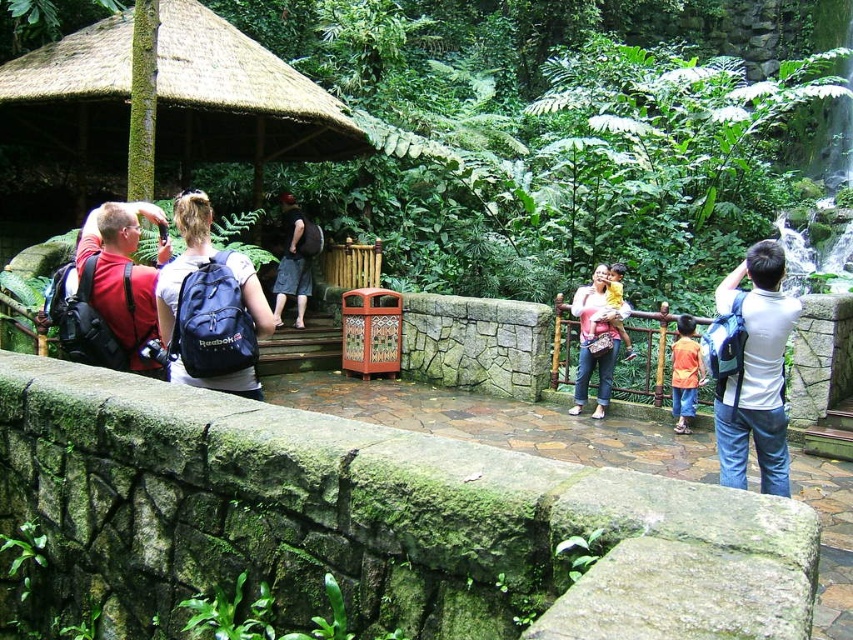
Does pink fabric purse at center have a smaller size compared to orange fabric shirt at center?

No.

Can you confirm if pink fabric purse at center is positioned below orange fabric shirt at center?

Incorrect, pink fabric purse at center is not positioned below orange fabric shirt at center.

The image size is (853, 640). In order to click on pink fabric purse at center in this screenshot , I will do `click(599, 333)`.

Who is positioned more to the right, white fabric backpack at right or matte red backpack at left?

From the viewer's perspective, white fabric backpack at right appears more on the right side.

Which is above, white fabric backpack at right or matte red backpack at left?

matte red backpack at left is above.

Which is behind, point (756, 396) or point (120, 298)?

The point (756, 396) is behind.

You are a GUI agent. You are given a task and a screenshot of the screen. Output one action in this format:
    pyautogui.click(x=<x>, y=<y>)
    Task: Click on the white fabric backpack at right
    The image size is (853, 640).
    Given the screenshot: What is the action you would take?
    756,372

Is point (202, 253) more distant than point (747, 416)?

No.

Find the location of a particular element. The height and width of the screenshot is (640, 853). blue fabric backpack at center is located at coordinates (210, 308).

This screenshot has height=640, width=853. I want to click on blue fabric backpack at center, so click(x=210, y=308).